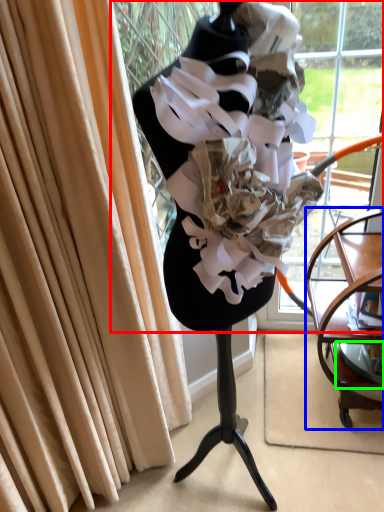
Question: Which is nearer to the shop window (highlighted by a red box)? furniture (highlighted by a blue box) or shelf (highlighted by a green box).

Choices:
 (A) furniture
 (B) shelf

Answer: (A)